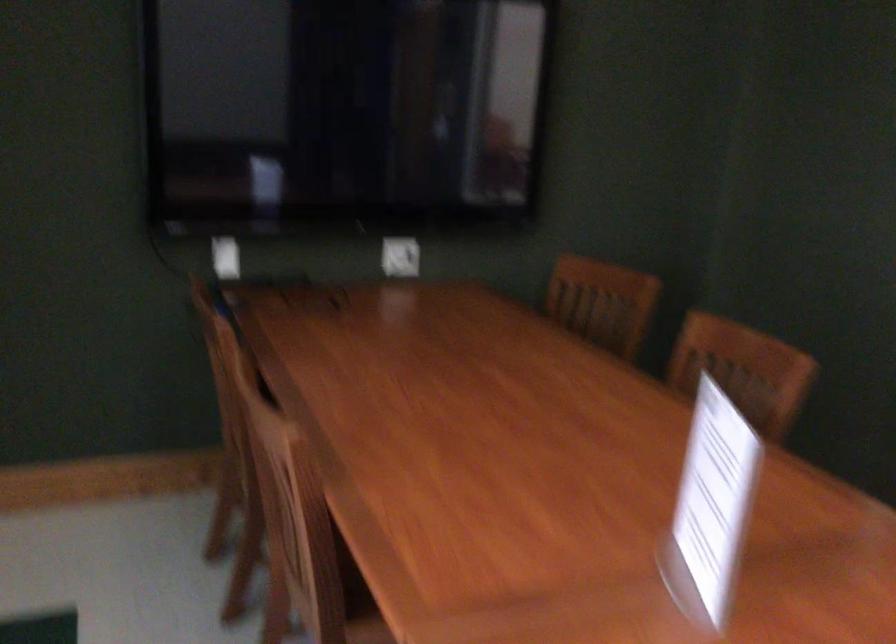
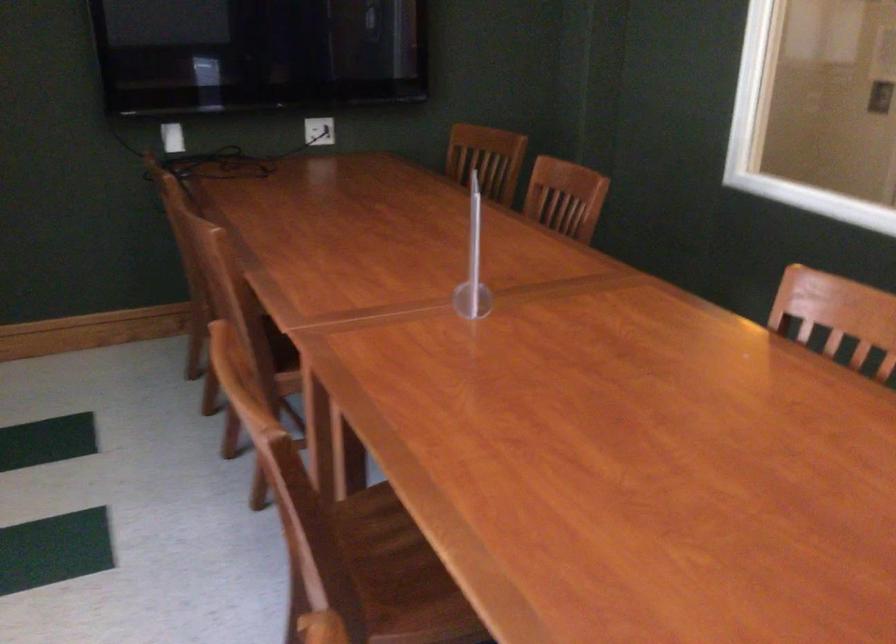
Where in the second image is the point corresponding to point (601, 303) from the first image?

(487, 158)